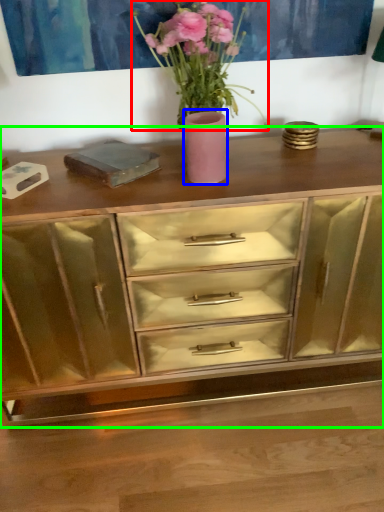
Question: Based on their relative distances, which object is nearer to floral arrangement (highlighted by a red box)? Choose from vase (highlighted by a blue box) and chest of drawers (highlighted by a green box).

Choices:
 (A) vase
 (B) chest of drawers

Answer: (A)